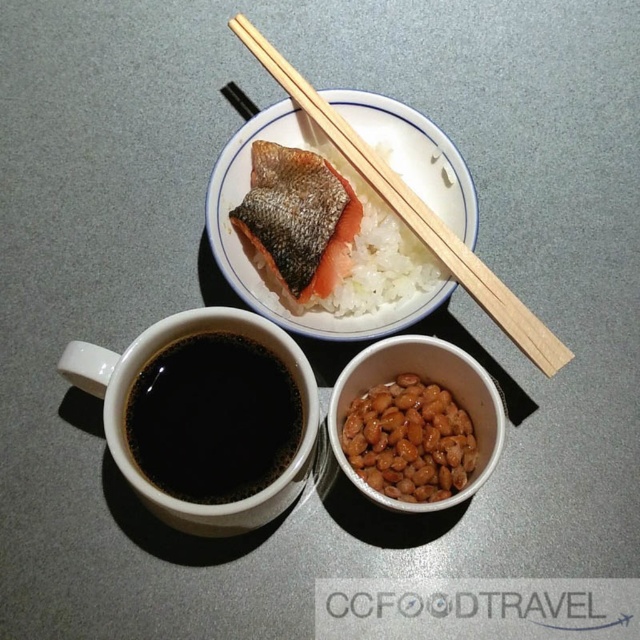
Who is positioned more to the left, black matte cup at lower left or wooden chopsticks at upper center?

From the viewer's perspective, black matte cup at lower left appears more on the left side.

Is point (182, 387) less distant than point (410, 220)?

Yes, it is in front of point (410, 220).

At what (x,y) coordinates should I click in order to perform the action: click on black matte cup at lower left. Please return your answer as a coordinate pair (x, y). Looking at the image, I should click on (212, 419).

Who is lower down, shiny brown beans at center or wooden chopsticks at upper center?

shiny brown beans at center

Is shiny brown beans at center to the left of wooden chopsticks at upper center from the viewer's perspective?

In fact, shiny brown beans at center is to the right of wooden chopsticks at upper center.

Where is `shiny brown beans at center`? The width and height of the screenshot is (640, 640). shiny brown beans at center is located at coordinates (410, 440).

Does black matte cup at lower left appear over white polished rice at center?

Actually, black matte cup at lower left is below white polished rice at center.

Is black matte cup at lower left closer to the viewer compared to white polished rice at center?

Yes, black matte cup at lower left is closer to the viewer.

Is point (211, 336) positioned after point (332, 196)?

No, it is not.

The image size is (640, 640). In order to click on black matte cup at lower left in this screenshot , I will do `click(212, 419)`.